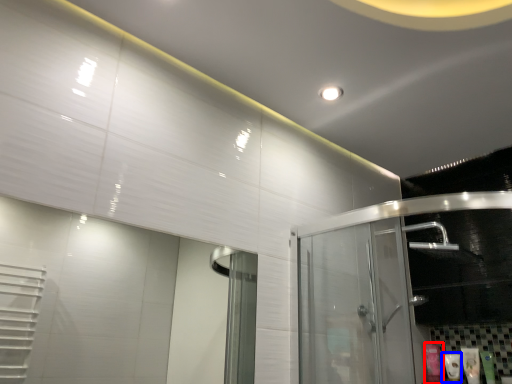
Question: Which object appears closest to the camera in this image, toiletry (highlighted by a red box) or toiletry (highlighted by a blue box)?

Choices:
 (A) toiletry
 (B) toiletry

Answer: (B)